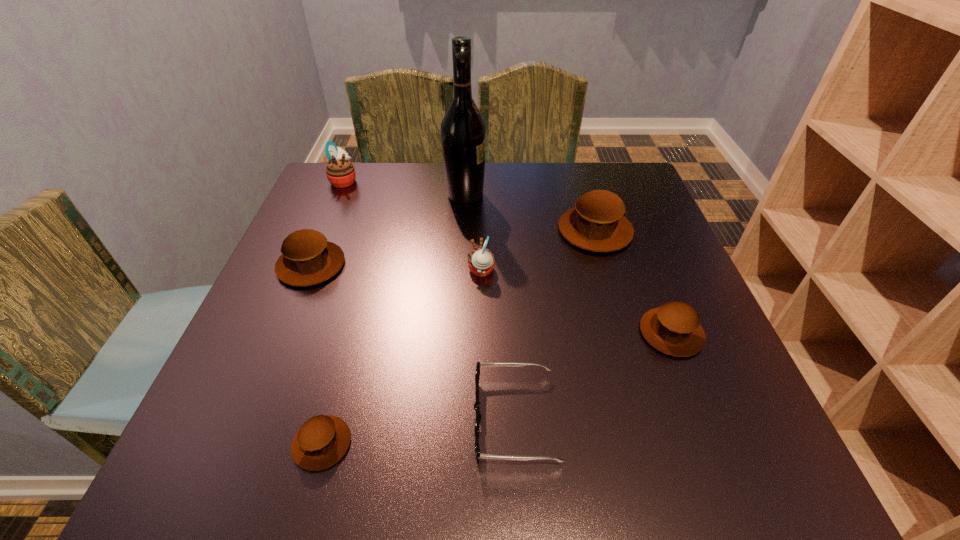
I want to click on object that is at the far right corner, so click(x=596, y=223).

Locate an element on the screen. The width and height of the screenshot is (960, 540). blank area at the far edge is located at coordinates (518, 174).

Find the location of a particular element. free location at the near edge of the desktop is located at coordinates (449, 453).

The image size is (960, 540). I want to click on blank area at the left edge, so click(329, 219).

This screenshot has height=540, width=960. In the image, there is a desktop. Identify the location of vacant space at the right edge. (620, 282).

Image resolution: width=960 pixels, height=540 pixels. Identify the location of vacant area between the black wine bottle and the farthest muffin. (404, 188).

Identify the location of unoccupied area between the fourth muffin from left to right and the second brown muffin from left to right. (401, 357).

At what (x,y) coordinates should I click in order to perform the action: click on vacant point located between the tallest object and the biggest brown muffin. Please return your answer as a coordinate pair (x, y). This screenshot has height=540, width=960. Looking at the image, I should click on (530, 213).

Identify the location of free space that is in between the tallest object and the biggest brown muffin. The height and width of the screenshot is (540, 960). (530, 213).

Locate an element on the screen. vacant space that's between the black spectacles and the smallest brown muffin is located at coordinates (419, 430).